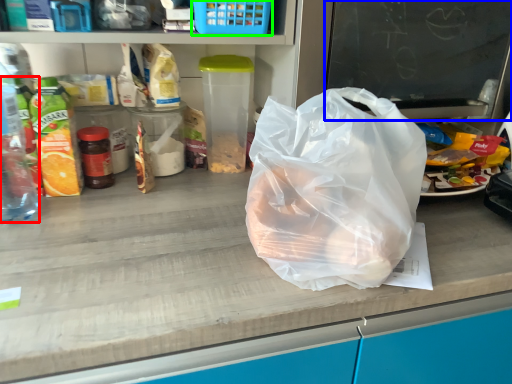
Question: Which object is the closest to the bottle (highlighted by a red box)? Choose among these: writing (highlighted by a blue box) or basket (highlighted by a green box).

Choices:
 (A) writing
 (B) basket

Answer: (B)